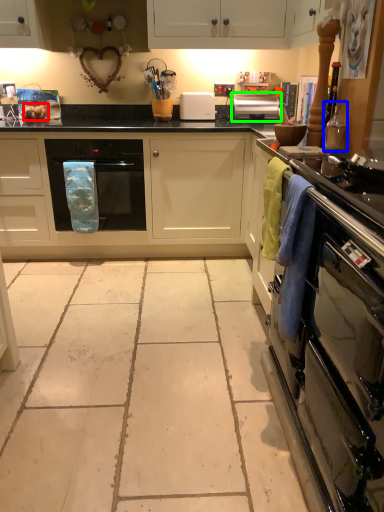
Question: Considering the real-world distances, which object is closest to food (highlighted by a red box)? appliance (highlighted by a blue box) or kitchen appliance (highlighted by a green box).

Choices:
 (A) appliance
 (B) kitchen appliance

Answer: (B)